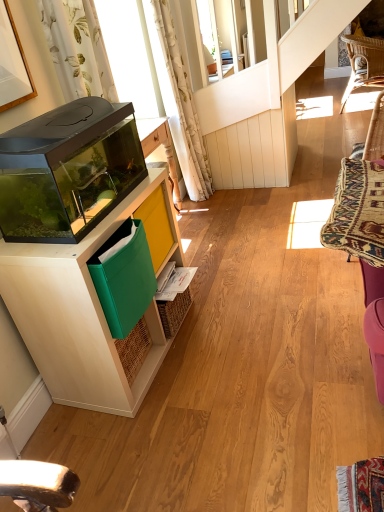
Locate an element on the screen. The height and width of the screenshot is (512, 384). free space in front of white floral fabric curtain at upper center, the 1th curtain viewed from the back is located at coordinates (215, 204).